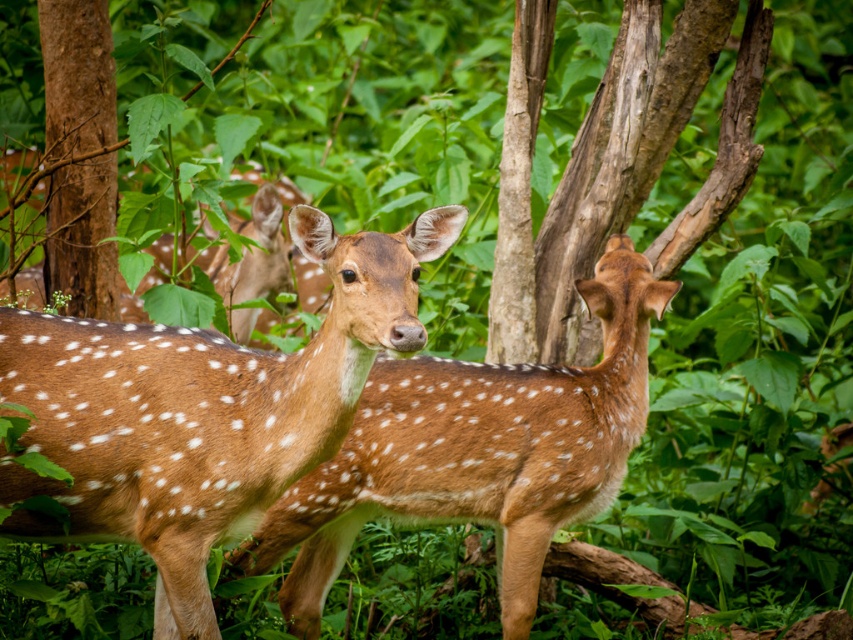
You are a photographer trying to capture the deer in the forest scene. You notice the brown speckled fur at center and the brown rough tree trunk at left. Which object is positioned to the right side of the other?

The brown speckled fur at center is to the right of the brown rough tree trunk at left.

You are a photographer trying to capture the brown spotted fur at center and the brown rough tree trunk at left in a single frame. Based on their positions, which object should you adjust your camera to focus on first to ensure both are in the frame?

The brown rough tree trunk at left is to the left of the brown spotted fur at center, so you should focus on the brown rough tree trunk at left first to ensure both are included in the frame.

You are standing in a forest and want to take a photo of the deer. The camera you have can focus on objects within 5 meters. Is the point at coordinate point (593,276) within the camera focus range?

The distance between the point (593,276) and the viewer is 4.27 meters, which is within the camera focus range of 5 meters. Therefore, the camera can focus on the point at coordinate point (593,276).